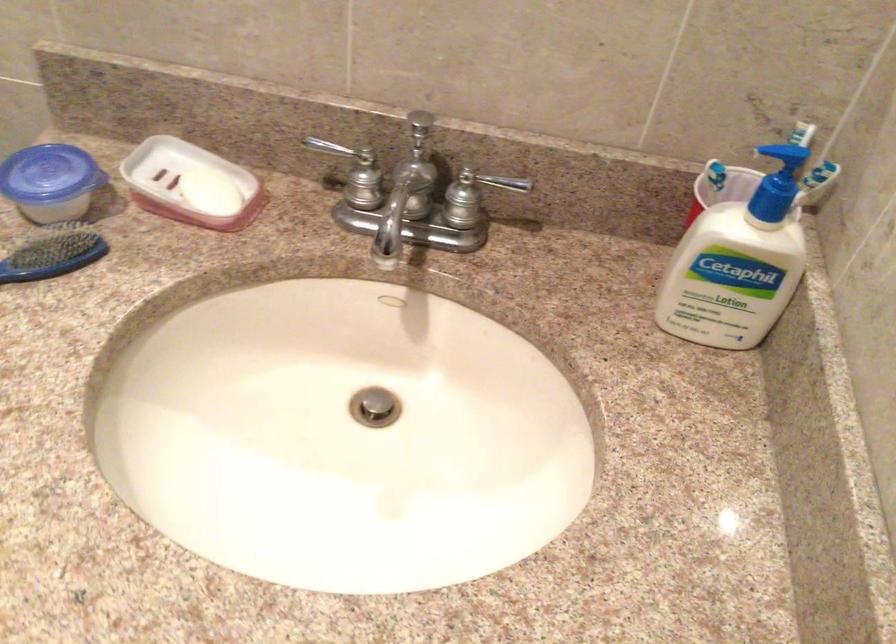
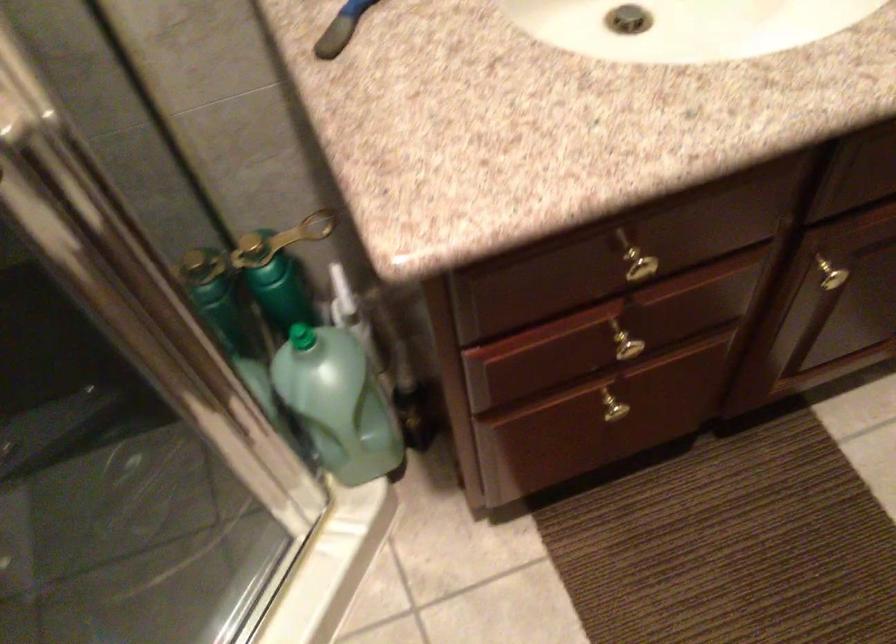
Question: The images are taken continuously from a first-person perspective. In which direction is your viewpoint rotating?

Choices:
 (A) Left
 (B) Right
 (C) Up
 (D) Down

Answer: (D)